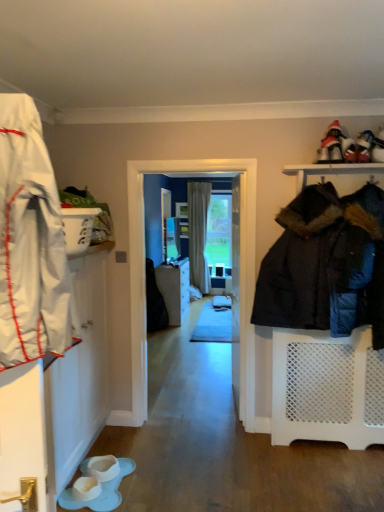
Question: Is matte gray cabinet at center bigger than beige fabric curtain at center?

Choices:
 (A) no
 (B) yes

Answer: (B)

Question: Is matte gray cabinet at center beside beige fabric curtain at center?

Choices:
 (A) yes
 (B) no

Answer: (B)

Question: Is beige fabric curtain at center a part of matte gray cabinet at center?

Choices:
 (A) no
 (B) yes

Answer: (A)

Question: Is matte gray cabinet at center further to camera compared to beige fabric curtain at center?

Choices:
 (A) yes
 (B) no

Answer: (B)

Question: Does matte gray cabinet at center have a greater height compared to beige fabric curtain at center?

Choices:
 (A) no
 (B) yes

Answer: (A)

Question: From a real-world perspective, relative to beige fabric curtain at center, is transparent glass screen door at center vertically above or below?

Choices:
 (A) below
 (B) above

Answer: (A)

Question: Does point (251, 258) appear closer or farther from the camera than point (190, 225)?

Choices:
 (A) closer
 (B) farther

Answer: (A)

Question: Is transparent glass screen door at center situated inside beige fabric curtain at center or outside?

Choices:
 (A) outside
 (B) inside

Answer: (A)

Question: From the image's perspective, is transparent glass screen door at center located above or below beige fabric curtain at center?

Choices:
 (A) below
 (B) above

Answer: (A)

Question: Would you say white fabric shoe at upper right, the 2th footwear in the bottom-to-top sequence, is to the left or to the right of dark blue quilted jacket at right in the picture?

Choices:
 (A) right
 (B) left

Answer: (A)

Question: Based on their sizes in the image, would you say white fabric shoe at upper right, arranged as the first footwear when viewed from the right, is bigger or smaller than dark blue quilted jacket at right?

Choices:
 (A) small
 (B) big

Answer: (A)

Question: In terms of height, does white fabric shoe at upper right, which is the 2th footwear in left-to-right order, look taller or shorter compared to dark blue quilted jacket at right?

Choices:
 (A) short
 (B) tall

Answer: (A)

Question: From the image's perspective, is white fabric shoe at upper right, the first footwear from the top, above or below dark blue quilted jacket at right?

Choices:
 (A) above
 (B) below

Answer: (A)

Question: Is white fabric coat at left spatially inside matte gray cabinet at center, or outside of it?

Choices:
 (A) outside
 (B) inside

Answer: (A)

Question: In terms of size, does white fabric coat at left appear bigger or smaller than matte gray cabinet at center?

Choices:
 (A) big
 (B) small

Answer: (B)